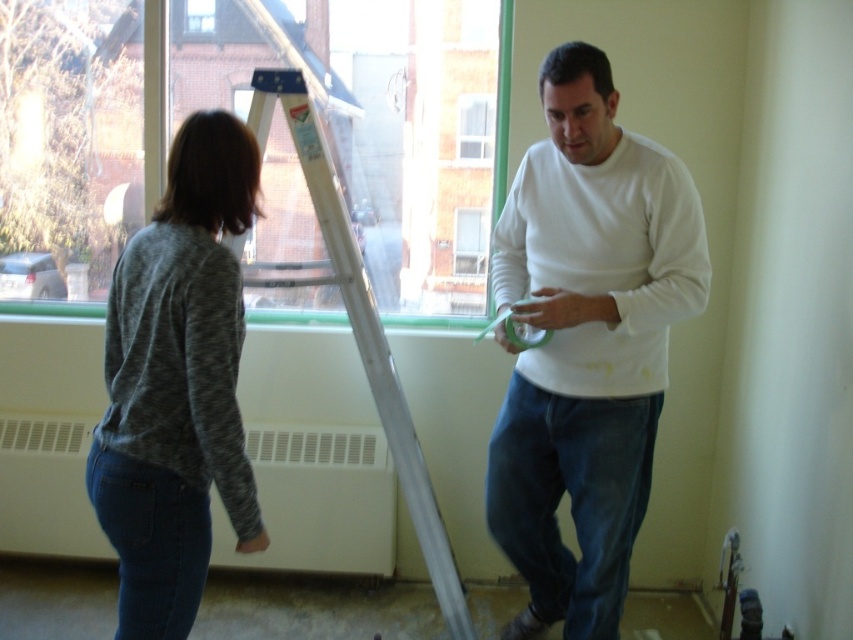
Question: Does white matte radiator at lower center appear on the right side of white metallic ladder at center?

Choices:
 (A) yes
 (B) no

Answer: (B)

Question: Which object is the farthest from the gray heathered sweater at left?

Choices:
 (A) white matte radiator at lower center
 (B) green glass window at upper left
 (C) clear glass window at center

Answer: (C)

Question: Does white matte shirt at center have a lesser width compared to clear glass window at upper center?

Choices:
 (A) no
 (B) yes

Answer: (A)

Question: Does white matte radiator at lower center appear on the left side of white metallic ladder at center?

Choices:
 (A) yes
 (B) no

Answer: (A)

Question: Among these objects, which one is nearest to the camera?

Choices:
 (A) green glass window at upper left
 (B) white matte shirt at center
 (C) clear glass window at upper center

Answer: (B)

Question: Which is farther from the white metallic ladder at center?

Choices:
 (A) white matte radiator at lower center
 (B) clear glass window at upper center
 (C) clear glass window at center
 (D) white matte shirt at center

Answer: (B)